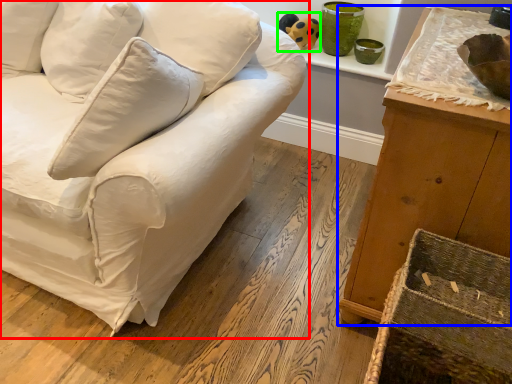
Question: Considering the real-world distances, which object is farthest from studio couch (highlighted by a red box)? furniture (highlighted by a blue box) or toy (highlighted by a green box)?

Choices:
 (A) furniture
 (B) toy

Answer: (B)